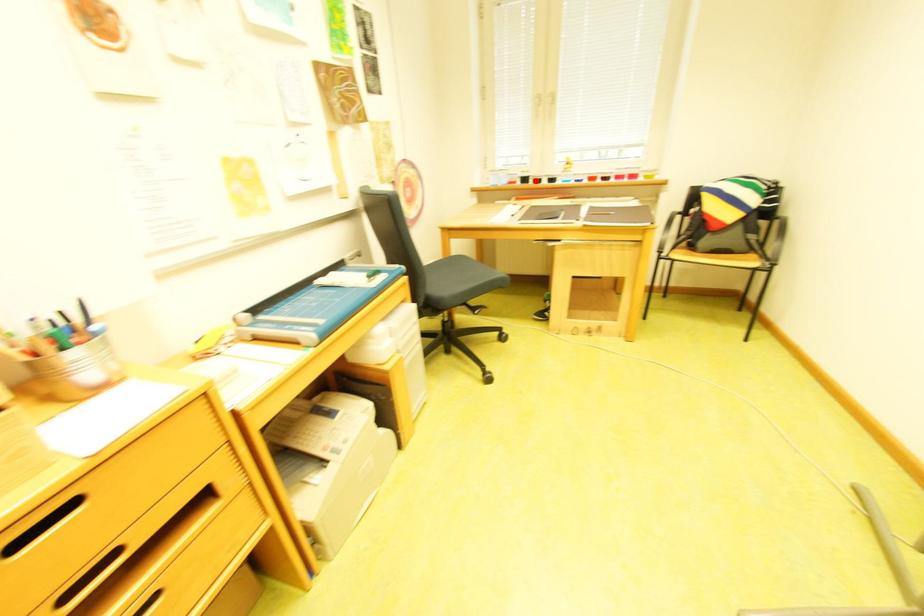
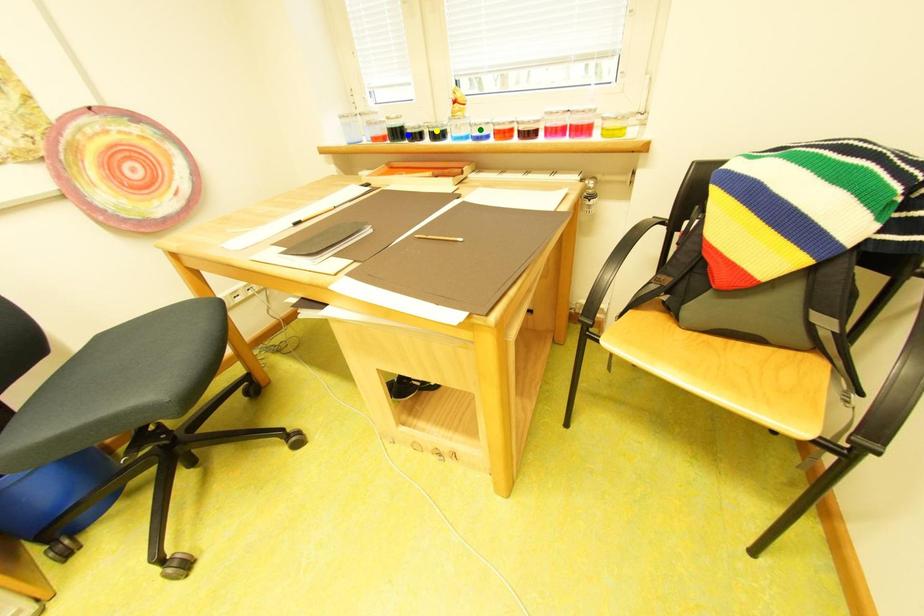
Question: I am providing you with two images of the same scene from different viewpoints. A red point is marked on the first image. You are given multiple points on the second image. Which point in image 2 is actually the same real-world point as the red point in image 1?

Choices:
 (A) blue point
 (B) yellow point
 (C) green point

Answer: (A)